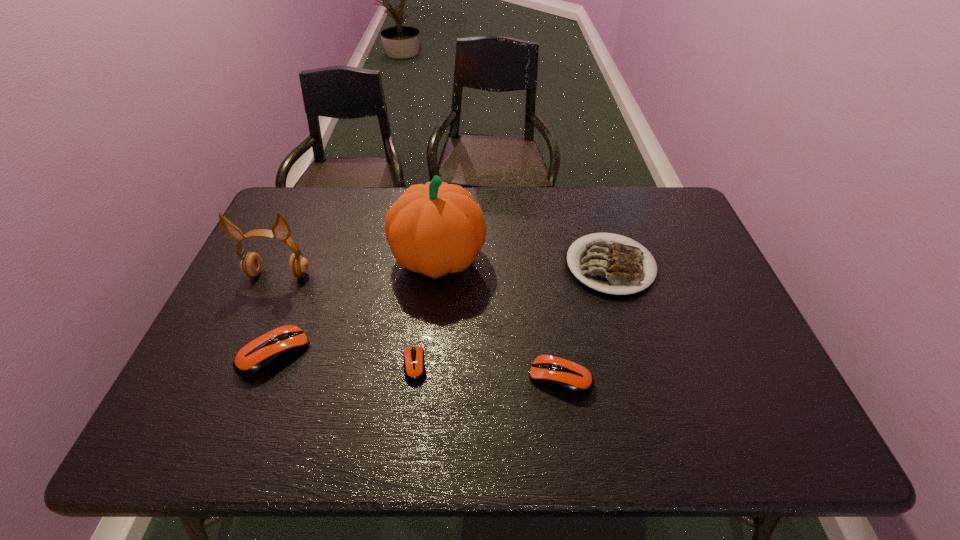
Identify the location of vacant space at the left edge. (276, 257).

Where is `free spot at the right edge of the desktop`? free spot at the right edge of the desktop is located at coordinates (650, 244).

Locate an element on the screen. The image size is (960, 540). vacant space at the far left corner is located at coordinates (297, 224).

In order to click on vacant region at the near left corner of the desktop in this screenshot , I will do pos(214,393).

At what (x,y) coordinates should I click in order to perform the action: click on vacant area that lies between the tallest object and the leftmost computer mouse. Please return your answer as a coordinate pair (x, y). The height and width of the screenshot is (540, 960). Looking at the image, I should click on (357, 306).

At what (x,y) coordinates should I click in order to perform the action: click on vacant space that is in between the tallest object and the plate. Please return your answer as a coordinate pair (x, y). Looking at the image, I should click on (524, 262).

The image size is (960, 540). Identify the location of vacant point located between the leftmost computer mouse and the earphone. (277, 314).

Where is `blank region between the fifth shortest object and the tallest object`? This screenshot has width=960, height=540. blank region between the fifth shortest object and the tallest object is located at coordinates pyautogui.click(x=359, y=266).

The height and width of the screenshot is (540, 960). In order to click on vacant area that lies between the tallest object and the second tallest object in this screenshot , I will do `click(359, 266)`.

Where is `vacant area between the plate and the leftmost computer mouse`? The height and width of the screenshot is (540, 960). vacant area between the plate and the leftmost computer mouse is located at coordinates (443, 309).